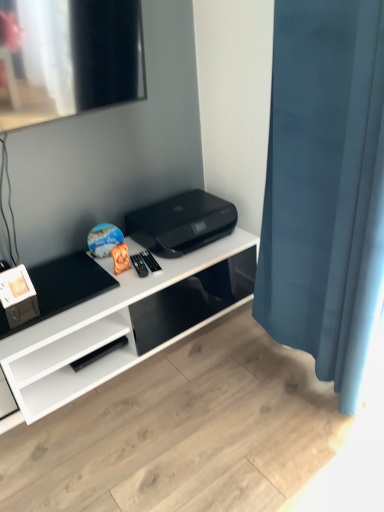
Locate an element on the screen. The height and width of the screenshot is (512, 384). free space above black plastic printer at center (from a real-world perspective) is located at coordinates (185, 207).